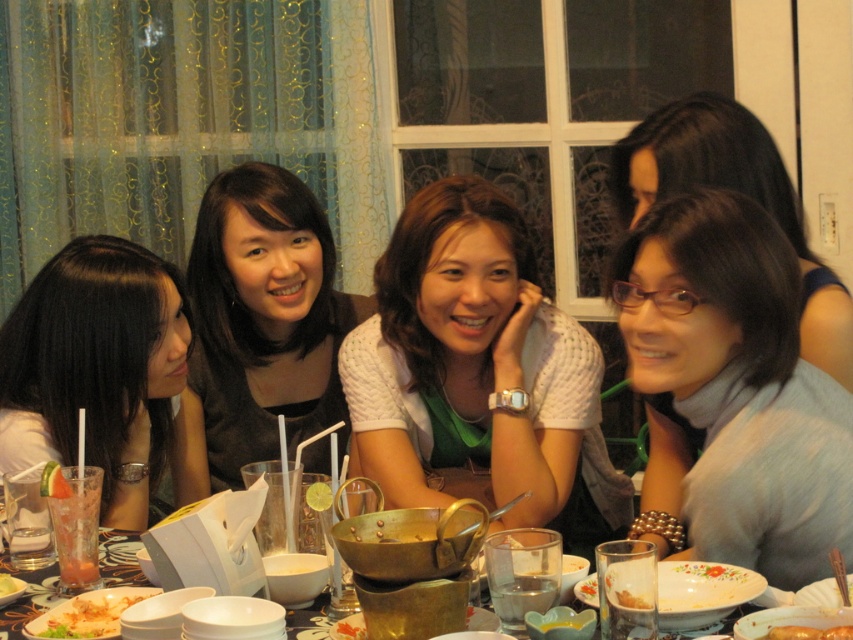
How much distance is there between smooth brown sausage at center and smooth white bowl at center?

smooth brown sausage at center is 1.13 meters from smooth white bowl at center.

Who is positioned more to the right, smooth brown sausage at center or smooth white bowl at center?

smooth brown sausage at center is more to the right.

Which is behind, point (780, 636) or point (10, 586)?

Point (10, 586)

In order to click on smooth brown sausage at center in this screenshot , I will do `click(809, 632)`.

Does clear glass water at table center have a greater height compared to smooth white bowl at center?

Yes.

Can you confirm if clear glass water at table center is positioned to the right of smooth white bowl at center?

Yes, clear glass water at table center is to the right of smooth white bowl at center.

Who is more forward, (509, 627) or (3, 593)?

Point (509, 627)

This screenshot has height=640, width=853. Find the location of `clear glass water at table center`. clear glass water at table center is located at coordinates (521, 596).

Is white knitted sweater at center thinner than smooth white bowl at center?

No.

Is point (450, 460) positioned in front of point (4, 573)?

That is False.

The height and width of the screenshot is (640, 853). Identify the location of white knitted sweater at center. (479, 372).